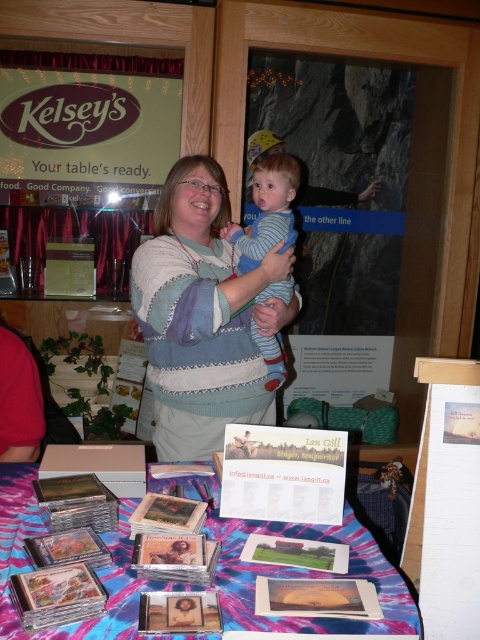
Question: Which of the following is the farthest from the observer?

Choices:
 (A) (255, 624)
 (B) (213, 356)
 (C) (260, 179)

Answer: (C)

Question: In this image, where is tie-dye fabric at lower center located relative to striped cotton shirt at center?

Choices:
 (A) above
 (B) below

Answer: (B)

Question: Can you confirm if tie-dye fabric at lower center is positioned below striped cotton shirt at center?

Choices:
 (A) yes
 (B) no

Answer: (A)

Question: Which object appears closest to the camera in this image?

Choices:
 (A) tie-dye fabric at lower center
 (B) striped cotton shirt at center

Answer: (A)

Question: Which of the following is the farthest from the observer?

Choices:
 (A) (247, 262)
 (B) (392, 570)
 (C) (252, 408)

Answer: (A)

Question: From the image, what is the correct spatial relationship of knitted sweater at center in relation to striped cotton shirt at center?

Choices:
 (A) right
 (B) left

Answer: (B)